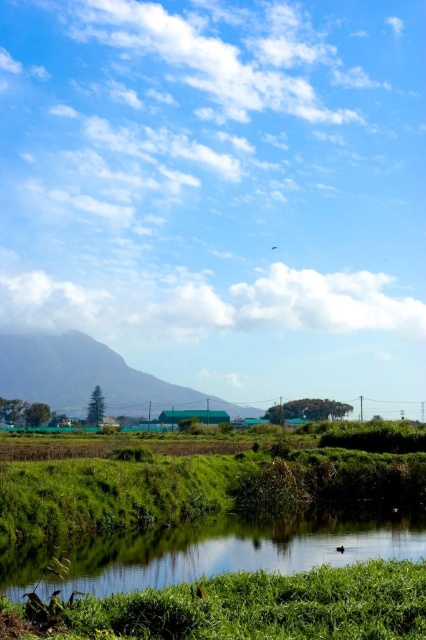
You are a gardener who wants to plant flowers in the green grass at lower center and the green grassy stream at lower center. Based on their height, which area would be more suitable for planting tall sunflower plants?

The green grassy stream at lower center has a greater height than the green grass at lower center, making it more suitable for planting tall sunflower plants since taller plants require more space and nutrients available in taller grass areas.

You are standing at the edge of the water in the serene rural landscape. You see a point marked at coordinates (270,605). What is located at that point?

The point at coordinates (270,605) marks green grass at lower center.